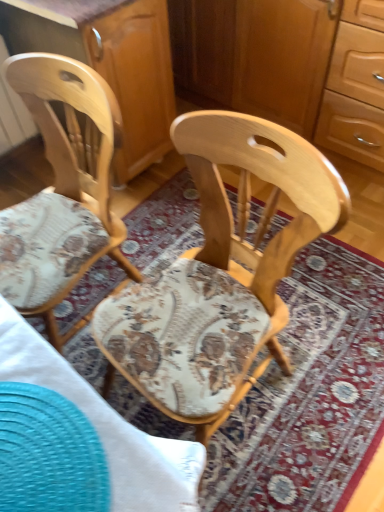
Question: Considering the relative sizes of natural wood chair at center, which is counted as the 1th chair, starting from the right, and natural wood chair at left, arranged as the 1th chair when viewed from the left, in the image provided, is natural wood chair at center, which is counted as the 1th chair, starting from the right, smaller than natural wood chair at left, arranged as the 1th chair when viewed from the left,?

Choices:
 (A) yes
 (B) no

Answer: (A)

Question: From the image's perspective, is natural wood chair at center, which is counted as the 1th chair, starting from the right, beneath natural wood chair at left, arranged as the 1th chair when viewed from the left?

Choices:
 (A) no
 (B) yes

Answer: (B)

Question: Is natural wood chair at center, which is counted as the 1th chair, starting from the right, shorter than natural wood chair at left, placed as the second chair when sorted from right to left?

Choices:
 (A) no
 (B) yes

Answer: (A)

Question: From the image's perspective, would you say natural wood chair at center, which is counted as the 1th chair, starting from the right, is positioned over natural wood chair at left, arranged as the 1th chair when viewed from the left?

Choices:
 (A) no
 (B) yes

Answer: (A)

Question: Are natural wood chair at center, which is counted as the 1th chair, starting from the right, and natural wood chair at left, arranged as the 1th chair when viewed from the left, far apart?

Choices:
 (A) yes
 (B) no

Answer: (B)

Question: Is natural wood chair at left, arranged as the 1th chair when viewed from the left, inside natural wood chair at center, which appears as the 2th chair when viewed from the left?

Choices:
 (A) no
 (B) yes

Answer: (A)

Question: Does natural wood chair at left, placed as the second chair when sorted from right to left, come behind smooth teal placemat at lower left?

Choices:
 (A) no
 (B) yes

Answer: (B)

Question: Is natural wood chair at left, arranged as the 1th chair when viewed from the left, next to smooth teal placemat at lower left and touching it?

Choices:
 (A) no
 (B) yes

Answer: (A)

Question: Does natural wood chair at left, placed as the second chair when sorted from right to left, have a larger size compared to smooth teal placemat at lower left?

Choices:
 (A) yes
 (B) no

Answer: (A)

Question: Is natural wood chair at left, arranged as the 1th chair when viewed from the left, oriented towards smooth teal placemat at lower left?

Choices:
 (A) yes
 (B) no

Answer: (B)

Question: Is natural wood chair at left, placed as the second chair when sorted from right to left, far away from smooth teal placemat at lower left?

Choices:
 (A) no
 (B) yes

Answer: (A)

Question: Is natural wood chair at left, arranged as the 1th chair when viewed from the left, smaller than smooth teal placemat at lower left?

Choices:
 (A) no
 (B) yes

Answer: (A)

Question: From the image's perspective, is wooden cabinet at center beneath wooden dresser at center?

Choices:
 (A) no
 (B) yes

Answer: (B)